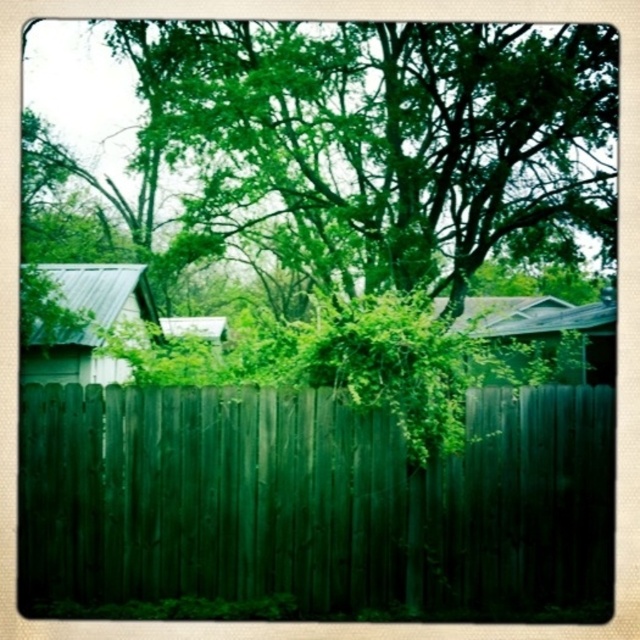
You are a painter who needs to paint both the dark green wood fence at center and the metallic green hut at left. If you have enough paint to cover 10 square meters, which object requires more paint based on their widths?

The dark green wood fence at center requires more paint because its width is larger than the metallic green hut at left, so it has a greater surface area to cover.

You are standing in front of the dark brown wooden fence in the scene. There is a point marked at coordinates [312,499]. What object is located at this point?

The point at coordinates [312,499] indicates the dark green wood fence at center.

You are a painter who needs to paint the dark green wood fence at center and the wooden shed at center. You have a ladder that can reach up to 2 meters. Can you paint both without needing a taller ladder?

The dark green wood fence at center is not as tall as the wooden shed at center, but since the shed is taller, if the shed is over 2 meters, you might need a taller ladder. However, the fence being shorter could be painted with the current ladder. But without knowing the exact height of the shed, it is uncertain.